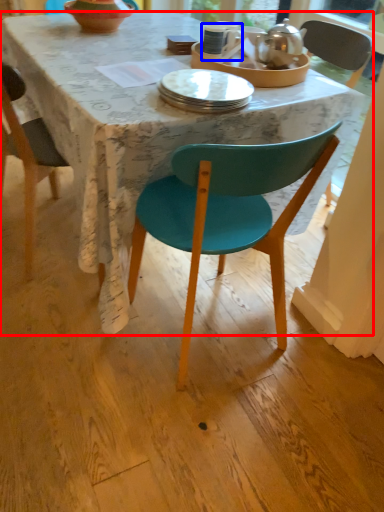
Question: Which object is further to the camera taking this photo, desk (highlighted by a red box) or coffee cup (highlighted by a blue box)?

Choices:
 (A) desk
 (B) coffee cup

Answer: (B)